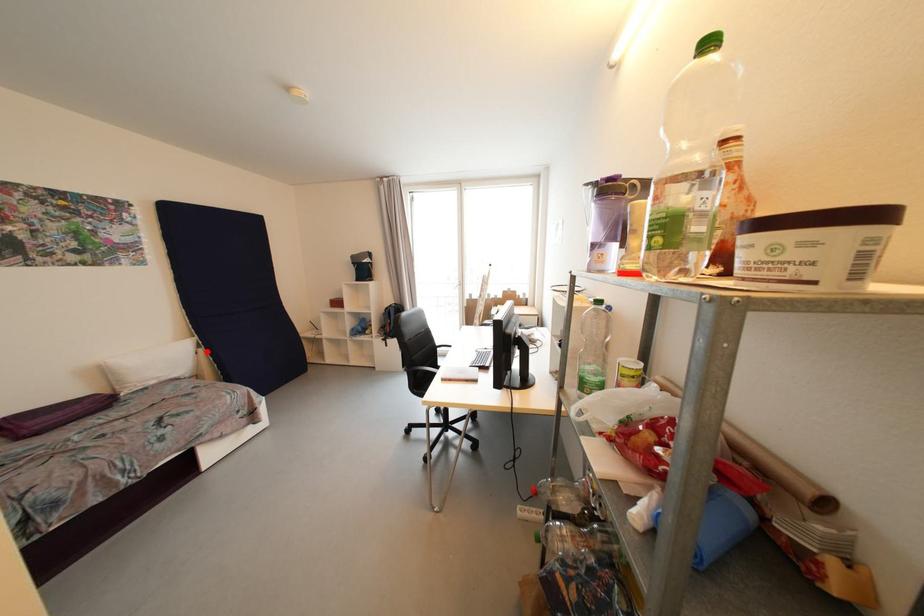
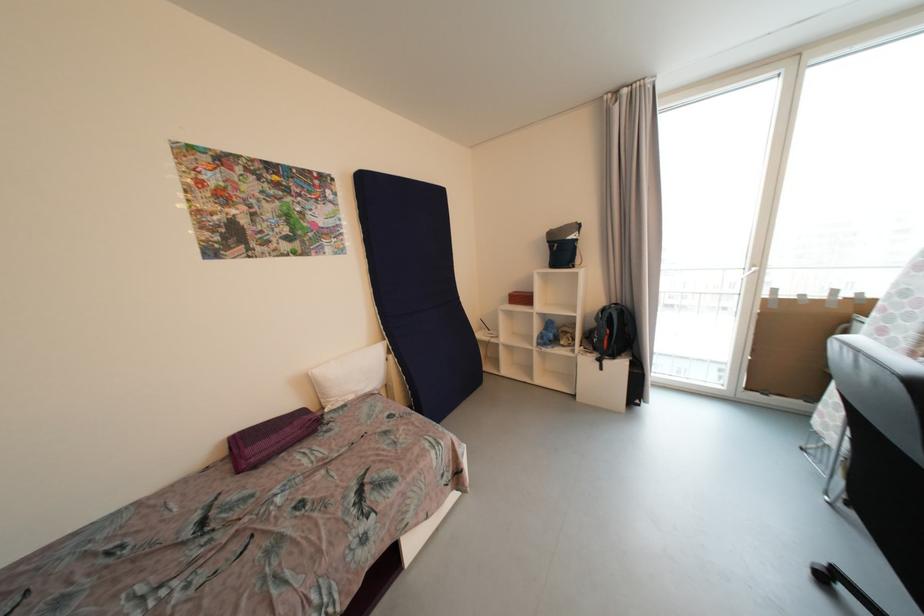
Find the pixel in the second image that matches the highlighted location in the first image.

(396, 359)